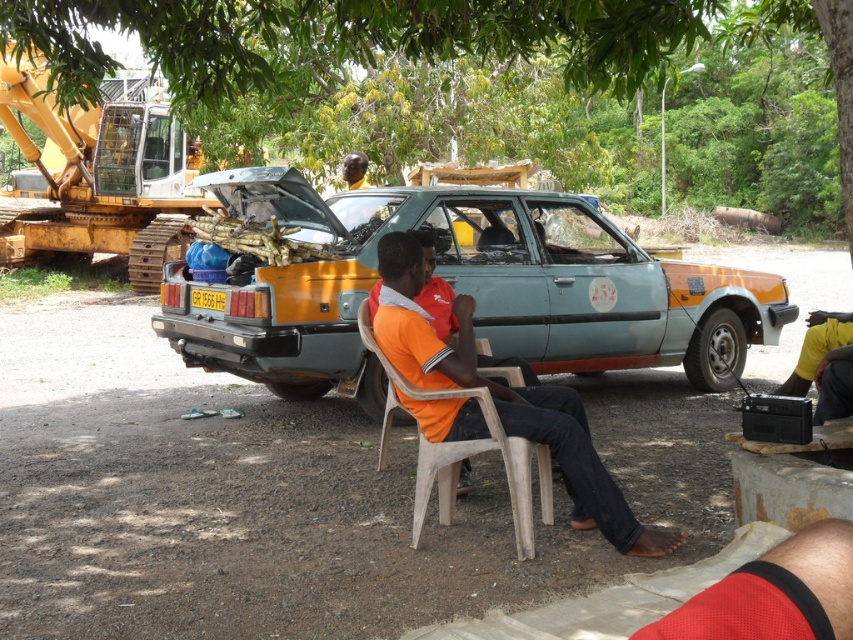
Is point (473, 300) positioned in front of point (525, 451)?

No, it is not.

Between orange fabric shirt at center and white plastic chair at center, which one is positioned lower?

Positioned lower is white plastic chair at center.

Who is more distant from viewer, (596, 515) or (389, 369)?

Positioned behind is point (389, 369).

What are the coordinates of `orange fabric shirt at center` in the screenshot? It's located at (503, 397).

Does teal matte car at center lie behind green leafy tree at upper center?

No, teal matte car at center is closer to the viewer.

Is teal matte car at center bigger than green leafy tree at upper center?

Indeed, teal matte car at center has a larger size compared to green leafy tree at upper center.

Is point (264, 344) positioned behind point (74, 68)?

No, it is in front of (74, 68).

Identify the location of teal matte car at center. The width and height of the screenshot is (853, 640). (462, 289).

Can you confirm if teal matte car at center is shorter than orange fabric shirt at center?

In fact, teal matte car at center may be taller than orange fabric shirt at center.

Can you confirm if teal matte car at center is positioned to the left of orange fabric shirt at center?

In fact, teal matte car at center is to the right of orange fabric shirt at center.

Between point (563, 208) and point (625, 529), which one is positioned in front?

Point (625, 529) is more forward.

The image size is (853, 640). I want to click on teal matte car at center, so click(x=462, y=289).